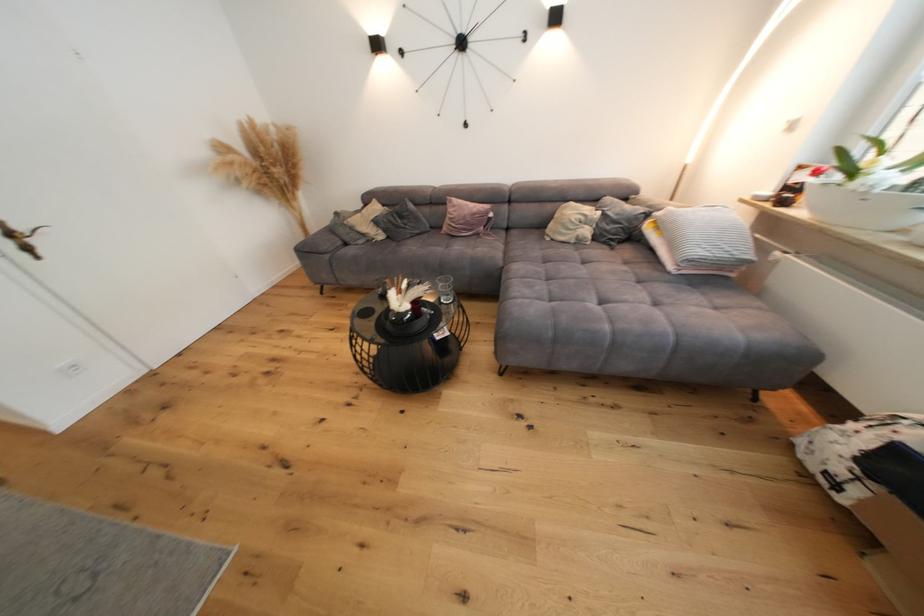
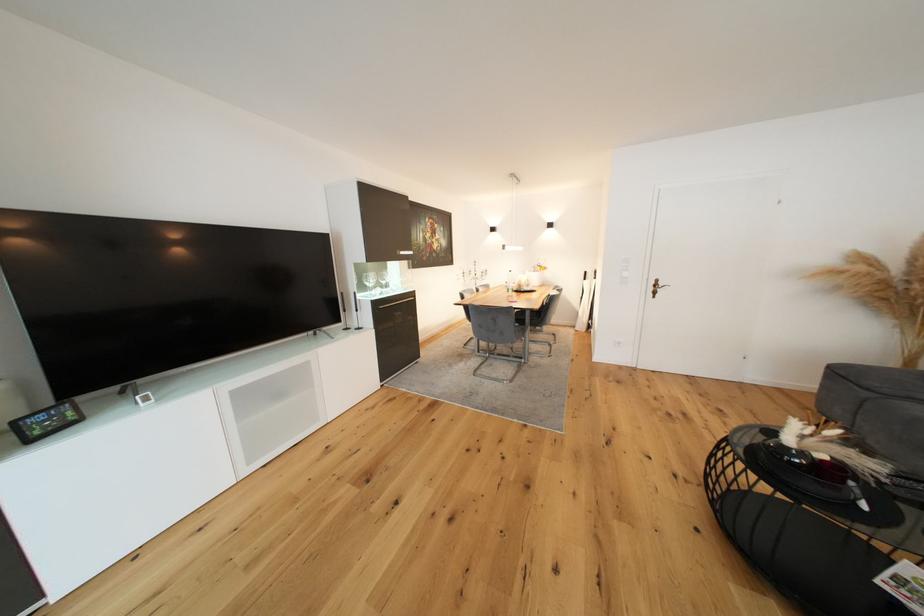
First-person continuous shooting, in which direction is the camera rotating?

The rotation direction of the camera is left-down.